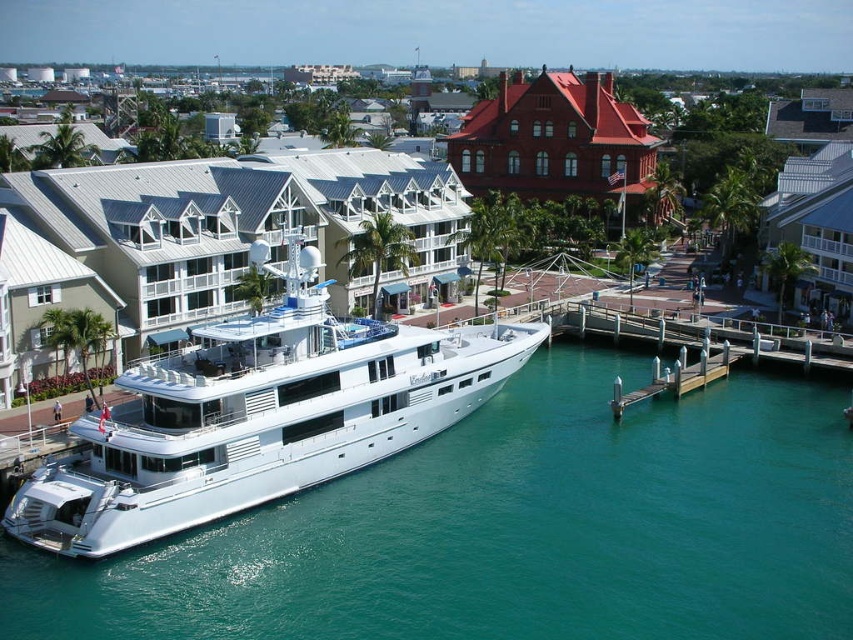
Question: Which point is closer to the camera?

Choices:
 (A) clear blue water at lower left
 (B) white glossy building at center
 (C) white glossy cruise ship at center

Answer: (A)

Question: Does white glossy cruise ship at center have a smaller size compared to wooden dock at lower right?

Choices:
 (A) yes
 (B) no

Answer: (B)

Question: Estimate the real-world distances between objects in this image. Which object is farther from the white glossy building at center?

Choices:
 (A) white glossy cruise ship at center
 (B) wooden dock at lower right
 (C) red brick building at upper center

Answer: (C)

Question: Among these objects, which one is nearest to the camera?

Choices:
 (A) red brick building at upper center
 (B) white glossy cruise ship at center
 (C) clear blue water at lower left

Answer: (C)

Question: Is clear blue water at lower left positioned at the back of wooden dock at lower right?

Choices:
 (A) no
 (B) yes

Answer: (A)

Question: Does white glossy cruise ship at center appear on the left side of white glossy building at center?

Choices:
 (A) no
 (B) yes

Answer: (A)